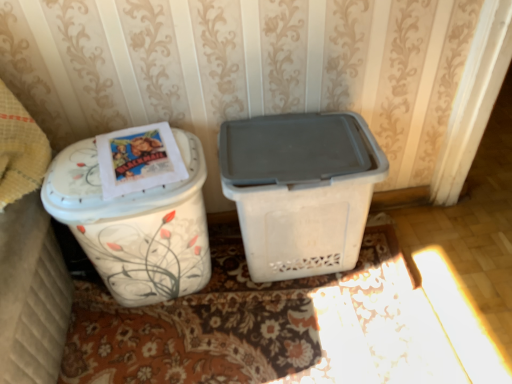
Question: Does floral-patterned carpet at lower center appear on the left side of white floral-patterned trash can at left, which ranks as the second waste container in right-to-left order?

Choices:
 (A) no
 (B) yes

Answer: (A)

Question: Is floral-patterned carpet at lower center far from white floral-patterned trash can at left, which ranks as the second waste container in right-to-left order?

Choices:
 (A) yes
 (B) no

Answer: (B)

Question: Is floral-patterned carpet at lower center facing towards white floral-patterned trash can at left, which ranks as the second waste container in right-to-left order?

Choices:
 (A) no
 (B) yes

Answer: (A)

Question: Considering the relative sizes of floral-patterned carpet at lower center and white floral-patterned trash can at left, which ranks as the second waste container in right-to-left order, in the image provided, is floral-patterned carpet at lower center shorter than white floral-patterned trash can at left, which ranks as the second waste container in right-to-left order,?

Choices:
 (A) yes
 (B) no

Answer: (A)

Question: Does floral-patterned carpet at lower center touch white floral-patterned trash can at left, which ranks as the second waste container in right-to-left order?

Choices:
 (A) yes
 (B) no

Answer: (B)

Question: Is point (1, 120) closer or farther from the camera than point (82, 198)?

Choices:
 (A) farther
 (B) closer

Answer: (A)

Question: From a real-world perspective, is white floral-patterned container at left positioned above or below white floral-patterned trash can at left, which ranks as the second waste container in right-to-left order?

Choices:
 (A) above
 (B) below

Answer: (A)

Question: In terms of height, does white floral-patterned container at left look taller or shorter compared to white floral-patterned trash can at left, which ranks as the second waste container in right-to-left order?

Choices:
 (A) short
 (B) tall

Answer: (B)

Question: Is white floral-patterned container at left situated inside white floral-patterned trash can at left, which ranks as the second waste container in right-to-left order, or outside?

Choices:
 (A) inside
 (B) outside

Answer: (B)

Question: Looking at their shapes, would you say white floral-patterned container at left is wider or thinner than floral-patterned carpet at lower center?

Choices:
 (A) thin
 (B) wide

Answer: (A)

Question: Is point (20, 370) closer or farther from the camera than point (229, 256)?

Choices:
 (A) farther
 (B) closer

Answer: (B)

Question: Would you say white floral-patterned container at left is to the left or to the right of floral-patterned carpet at lower center in the picture?

Choices:
 (A) right
 (B) left

Answer: (B)

Question: Is white floral-patterned container at left taller or shorter than floral-patterned carpet at lower center?

Choices:
 (A) short
 (B) tall

Answer: (B)

Question: Is white plastic bin at center, acting as the second waste container starting from the left, inside or outside of floral-patterned carpet at lower center?

Choices:
 (A) inside
 (B) outside

Answer: (B)

Question: From the image's perspective, is white plastic bin at center, acting as the second waste container starting from the left, located above or below floral-patterned carpet at lower center?

Choices:
 (A) below
 (B) above

Answer: (B)